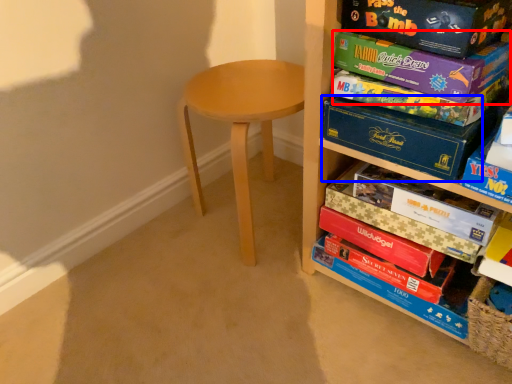
Question: Which object appears closest to the camera in this image, paperback book (highlighted by a red box) or paperback book (highlighted by a blue box)?

Choices:
 (A) paperback book
 (B) paperback book

Answer: (A)